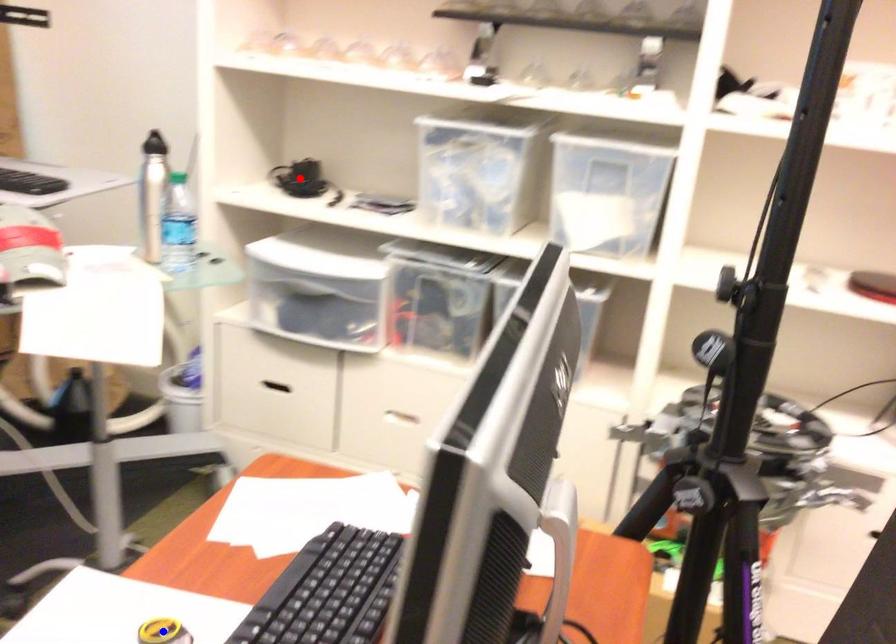
Question: Which of the two points in the image is closer to the camera?

Choices:
 (A) Blue point is closer.
 (B) Red point is closer.

Answer: (A)